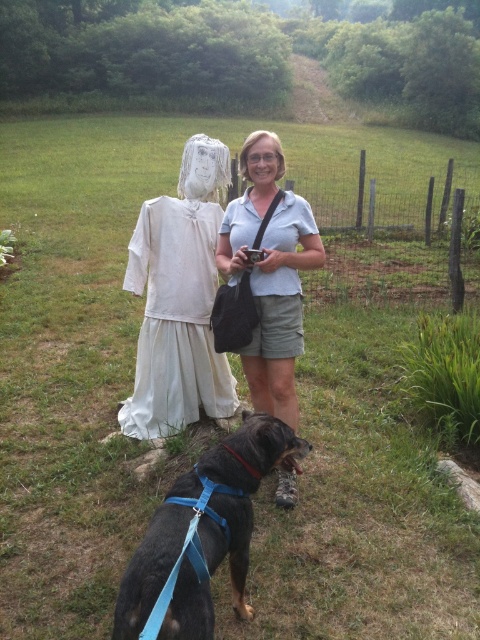
Is black textured dog at lower center positioned at the back of light blue cotton shirt at center?

No, it is in front of light blue cotton shirt at center.

Who is higher up, black textured dog at lower center or light blue cotton shirt at center?

Positioned higher is light blue cotton shirt at center.

This screenshot has width=480, height=640. Describe the element at coordinates (202, 534) in the screenshot. I see `black textured dog at lower center` at that location.

I want to click on black textured dog at lower center, so click(x=202, y=534).

Who is higher up, white cotton dress at left or light blue cotton shirt at center?

light blue cotton shirt at center is above.

Is white cotton dress at left shorter than light blue cotton shirt at center?

Indeed, white cotton dress at left has a lesser height compared to light blue cotton shirt at center.

Between point (145, 378) and point (229, 256), which one is positioned in front?

Point (229, 256)

At what (x,y) coordinates should I click in order to perform the action: click on white cotton dress at left. Please return your answer as a coordinate pair (x, y). The width and height of the screenshot is (480, 640). Looking at the image, I should click on (176, 320).

Who is lower down, black textured dog at lower center or white cotton dress at left?

black textured dog at lower center is below.

Can you confirm if black textured dog at lower center is positioned above white cotton dress at left?

No, black textured dog at lower center is not above white cotton dress at left.

You are a GUI agent. You are given a task and a screenshot of the screen. Output one action in this format:
    pyautogui.click(x=<x>, y=<y>)
    Task: Click on the black textured dog at lower center
    
    Given the screenshot: What is the action you would take?
    pyautogui.click(x=202, y=534)